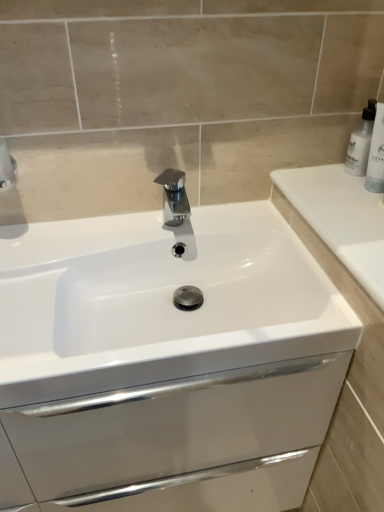
Where is `vacant area that lies to the right of polished chrome tap at center`? vacant area that lies to the right of polished chrome tap at center is located at coordinates (243, 232).